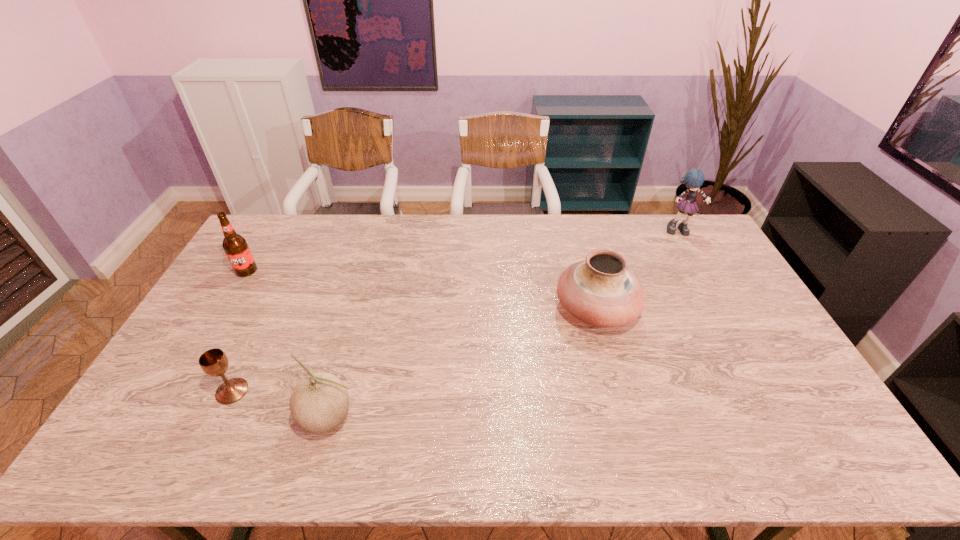
Locate an element on the screen. The image size is (960, 540). unoccupied position between the cantaloup and the second object from right to left is located at coordinates (463, 364).

Identify the location of free space between the third object from right to left and the fourth object from right to left. The width and height of the screenshot is (960, 540). pyautogui.click(x=281, y=405).

Where is `free spot between the shortest object and the rag doll`? The image size is (960, 540). free spot between the shortest object and the rag doll is located at coordinates coord(457,311).

Identify which object is the closest to the second farthest object. Please provide its 2D coordinates. Your answer should be formatted as a tuple, i.e. [(x, y)], where the tuple contains the x and y coordinates of a point satisfying the conditions above.

[(214, 362)]

Select which object appears as the third closest to the third object from left to right. Please provide its 2D coordinates. Your answer should be formatted as a tuple, i.e. [(x, y)], where the tuple contains the x and y coordinates of a point satisfying the conditions above.

[(599, 291)]